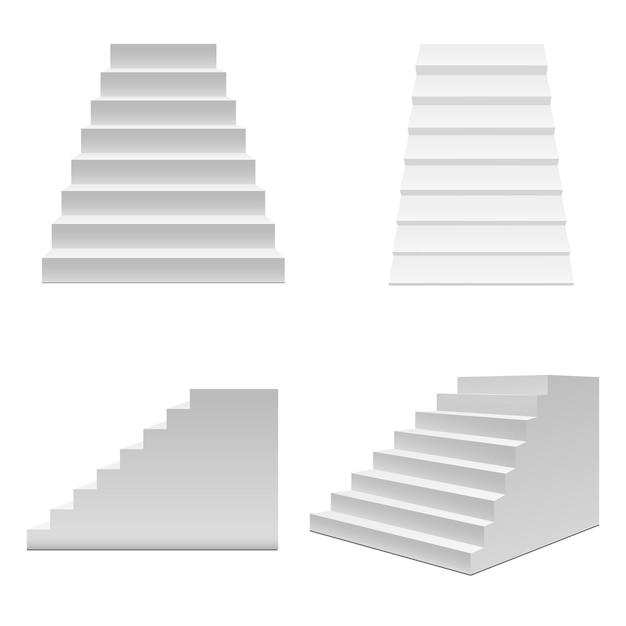
Identify the location of step on lower right staircase. This screenshot has width=626, height=626. (414, 540), (436, 513), (456, 490), (469, 464), (481, 443), (493, 416), (506, 394), (521, 374).